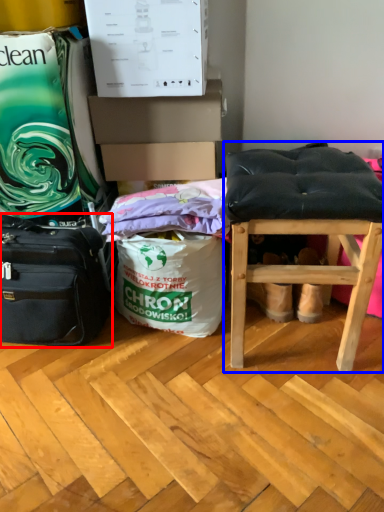
Question: Among these objects, which one is farthest to the camera, luggage and bags (highlighted by a red box) or stool (highlighted by a blue box)?

Choices:
 (A) luggage and bags
 (B) stool

Answer: (A)